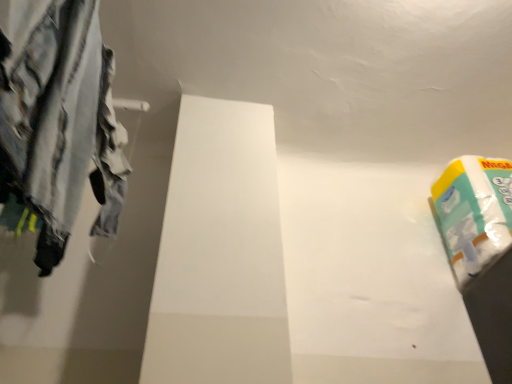
Question: Would you say striped cotton pants at left is inside or outside white glossy toilet paper at upper right?

Choices:
 (A) inside
 (B) outside

Answer: (B)

Question: Relative to white glossy toilet paper at upper right, is striped cotton pants at left in front or behind?

Choices:
 (A) behind
 (B) front

Answer: (B)

Question: Considering the positions of striped cotton pants at left and white glossy toilet paper at upper right in the image, is striped cotton pants at left taller or shorter than white glossy toilet paper at upper right?

Choices:
 (A) tall
 (B) short

Answer: (A)

Question: Relative to striped cotton pants at left, is white glossy toilet paper at upper right in front or behind?

Choices:
 (A) behind
 (B) front

Answer: (A)

Question: Is point (459, 271) closer or farther from the camera than point (27, 206)?

Choices:
 (A) closer
 (B) farther

Answer: (B)

Question: Considering the positions of white glossy toilet paper at upper right and striped cotton pants at left in the image, is white glossy toilet paper at upper right wider or thinner than striped cotton pants at left?

Choices:
 (A) wide
 (B) thin

Answer: (A)

Question: From the image's perspective, is white glossy toilet paper at upper right positioned above or below striped cotton pants at left?

Choices:
 (A) above
 (B) below

Answer: (B)